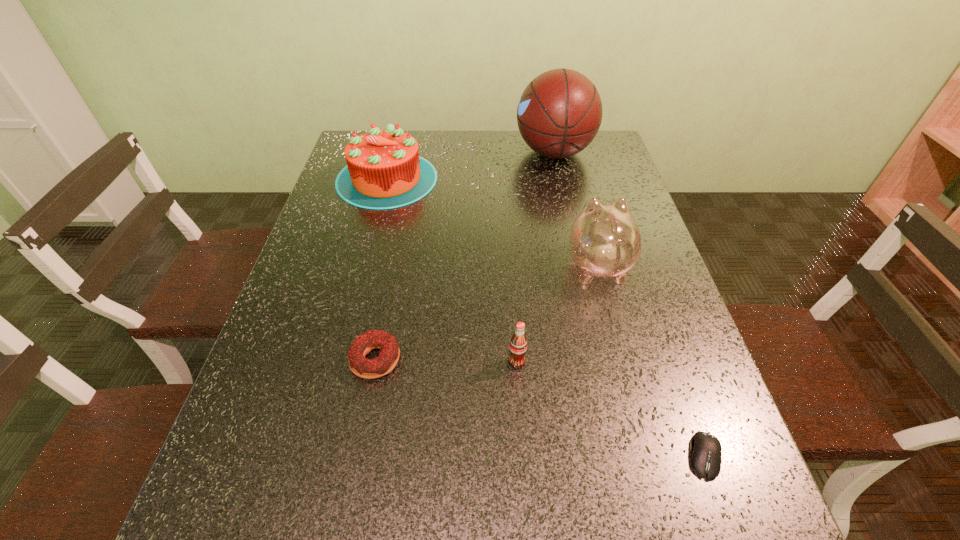
I want to click on piggy bank positioned at the right edge, so click(605, 240).

Locate an element on the screen. The width and height of the screenshot is (960, 540). computer equipment located in the right edge section of the desktop is located at coordinates (706, 454).

Where is `object at the far left corner`? The width and height of the screenshot is (960, 540). object at the far left corner is located at coordinates (384, 170).

Where is `object present at the far right corner`? Image resolution: width=960 pixels, height=540 pixels. object present at the far right corner is located at coordinates (559, 113).

Locate an element on the screen. The width and height of the screenshot is (960, 540). vacant position at the far edge of the desktop is located at coordinates click(509, 141).

The width and height of the screenshot is (960, 540). I want to click on free space at the near edge, so click(600, 537).

What are the coordinates of `vacant space at the left edge of the desktop` in the screenshot? It's located at (298, 453).

In the image, there is a desktop. At what (x,y) coordinates should I click in order to perform the action: click on free space at the right edge. Please return your answer as a coordinate pair (x, y). The image size is (960, 540). Looking at the image, I should click on (659, 429).

In the image, there is a desktop. Where is `vacant space at the far right corner`? vacant space at the far right corner is located at coordinates (588, 146).

The width and height of the screenshot is (960, 540). I want to click on empty space that is in between the second shortest object and the shortest object, so click(x=540, y=407).